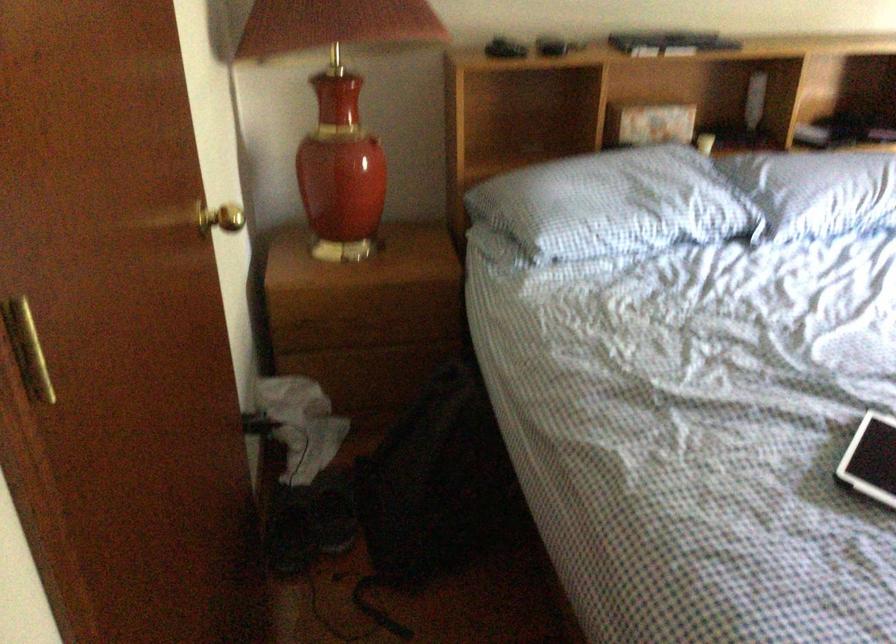
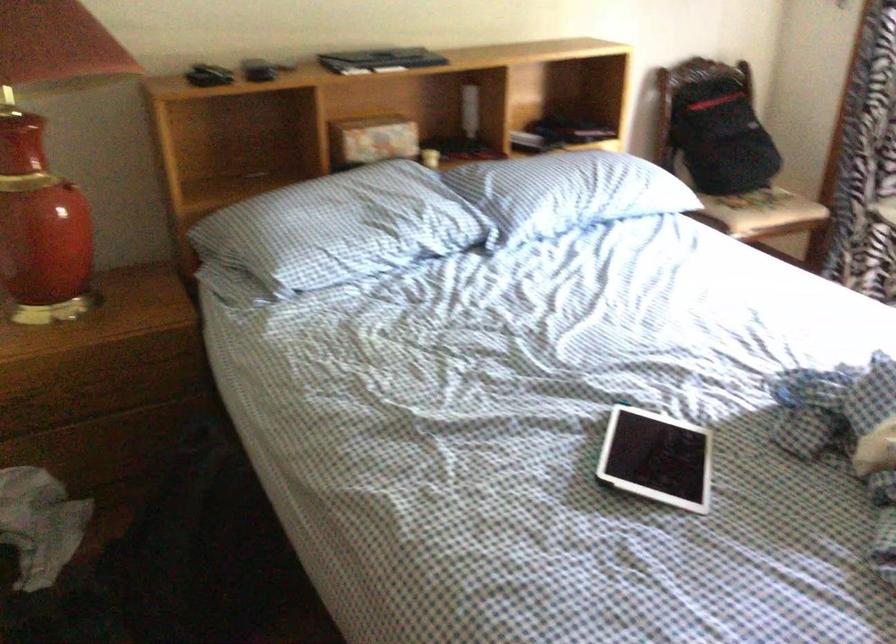
Question: The images are taken continuously from a first-person perspective. In which direction is your viewpoint rotating?

Choices:
 (A) Left
 (B) Right
 (C) Up
 (D) Down

Answer: (B)